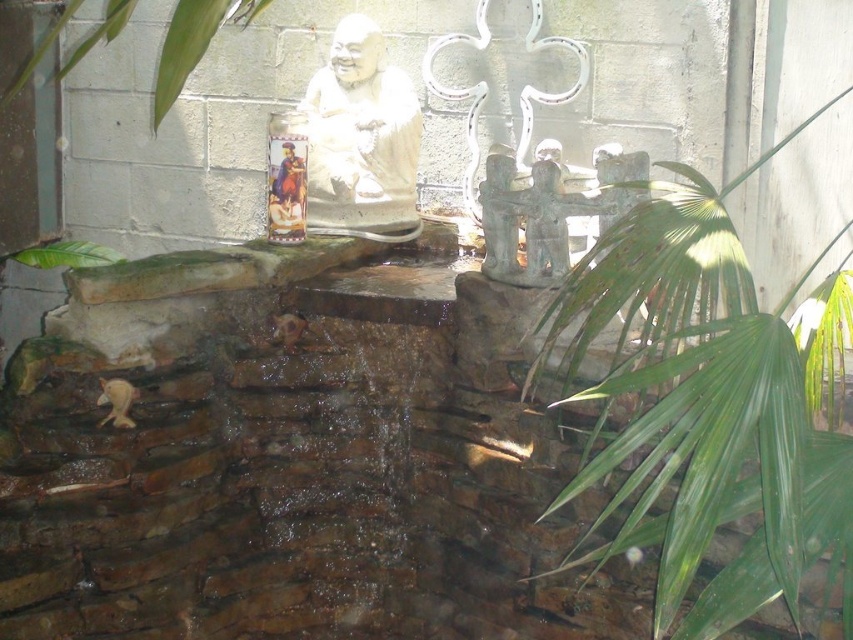
Question: Among these points, which one is nearest to the camera?

Choices:
 (A) (642, 173)
 (B) (729, 289)
 (C) (169, 100)
 (D) (107, 250)

Answer: (B)

Question: Can you confirm if green leafy plant at upper right is thinner than bronze statue at center?

Choices:
 (A) yes
 (B) no

Answer: (B)

Question: Which object is the closest to the bronze statue at center?

Choices:
 (A) white stone statue at center
 (B) green leafy plant at upper right
 (C) green leafy plant at upper left
 (D) green leafy plant at left

Answer: (B)

Question: Which of the following is the farthest from the observer?

Choices:
 (A) (514, 189)
 (B) (402, 193)
 (C) (711, 396)
 (D) (65, 64)

Answer: (D)

Question: Is green leafy plant at upper right thinner than green leafy plant at left?

Choices:
 (A) no
 (B) yes

Answer: (A)

Question: Can you confirm if green leafy plant at upper right is bigger than green leafy plant at upper left?

Choices:
 (A) yes
 (B) no

Answer: (A)